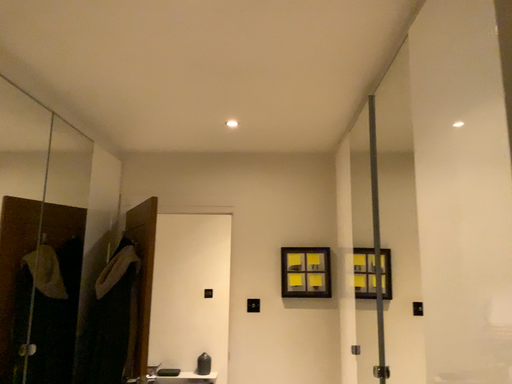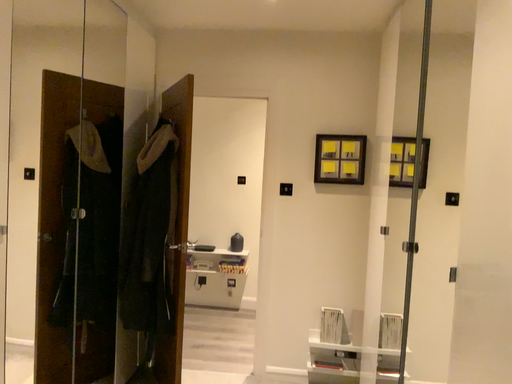
Question: How did the camera likely rotate when shooting the video?

Choices:
 (A) rotated upward
 (B) rotated downward

Answer: (B)